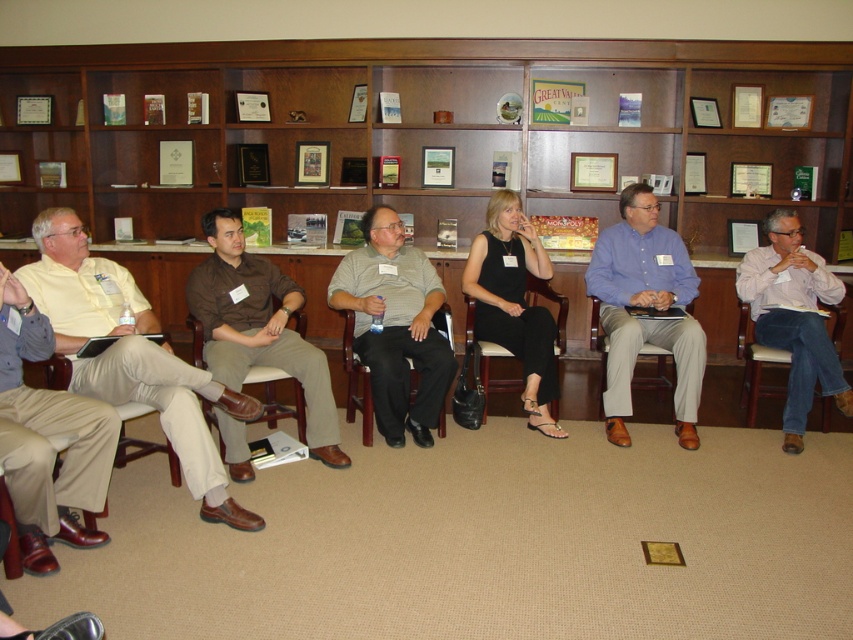
You are standing in the meeting room and see the point marked at coordinates (x=395, y=324). Which object in the scene does this point correspond to?

The point at coordinates (x=395, y=324) corresponds to the gray striped shirt at center.

You are a photographer standing at the back of the room. You want to take a photo of the brown cotton shirt at center without the khaki cotton pants at center blocking it. Is this possible?

The khaki cotton pants at center is in front of the brown cotton shirt at center, so it will block the view. You cannot take a photo of the brown cotton shirt at center without the khaki cotton pants at center blocking it.

You are a tailor who needs to determine if the khaki cotton pants at center and the brown cotton shirt at center can be altered to fit a client who prefers looser clothing. Based on their sizes, which item might require less adjustment?

The khaki cotton pants at center has a larger size compared to brown cotton shirt at center. Since the client prefers looser clothing, the khaki cotton pants at center might require less adjustment as it already has a larger size, making it closer to the desired fit without significant changes.